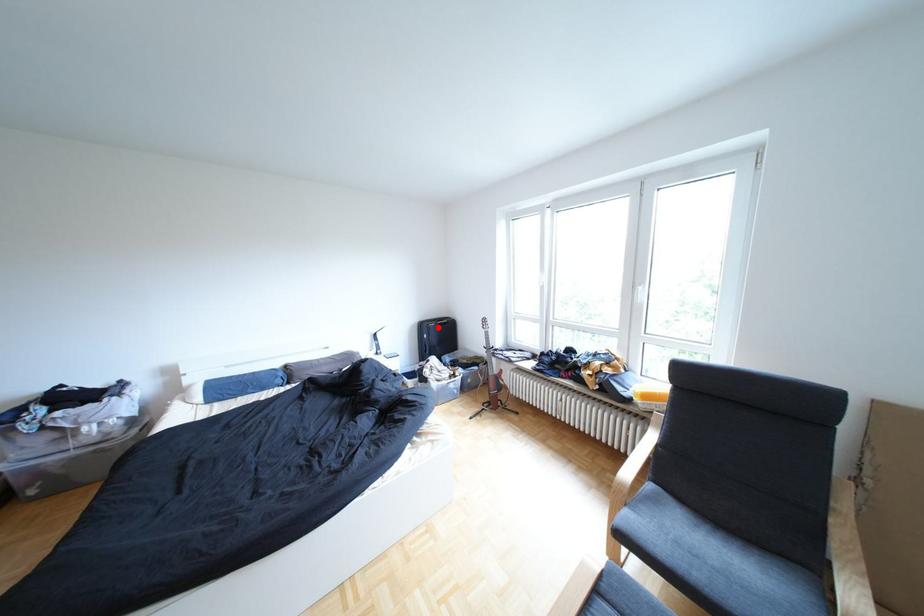
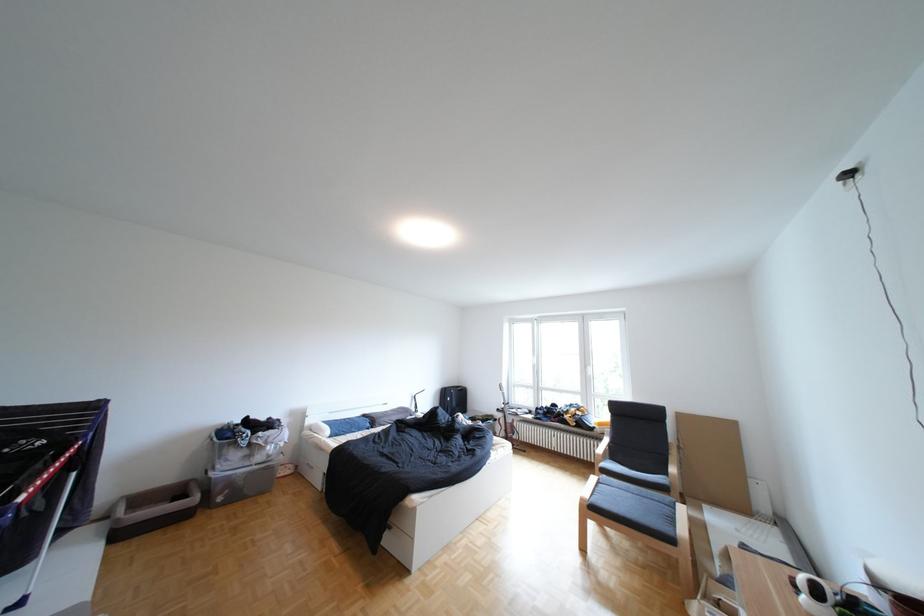
In the second image, find the point that corresponds to the highlighted location in the first image.

(459, 392)